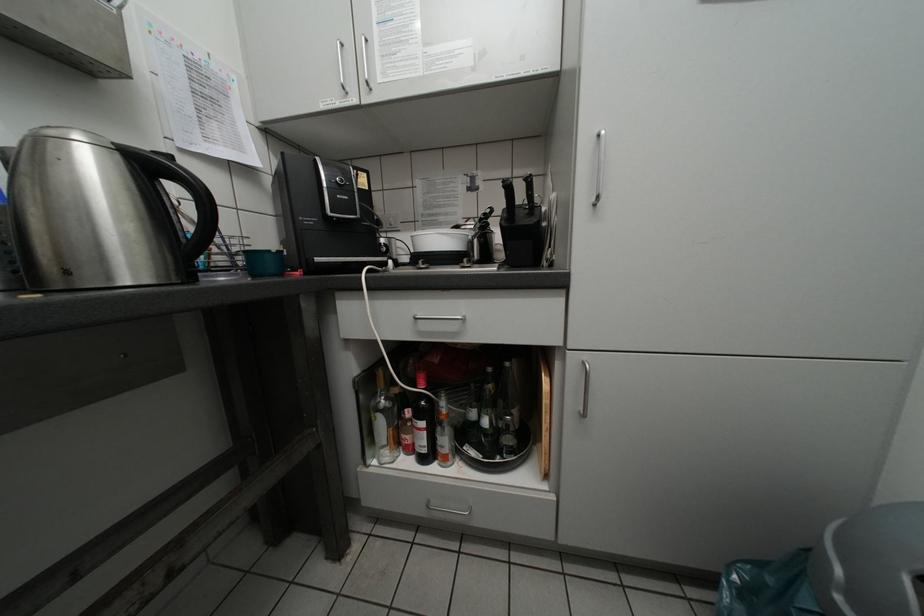
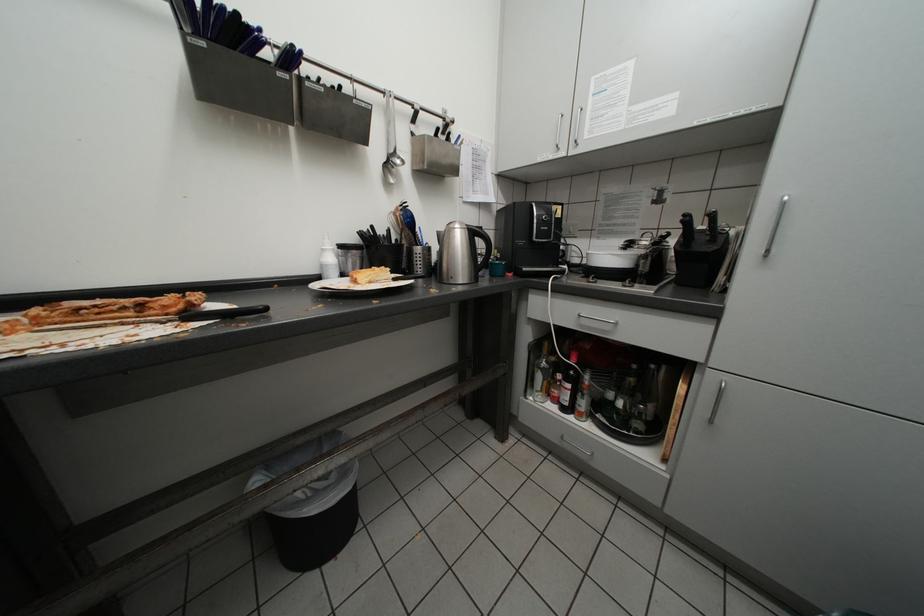
Question: Based on the continuous images, in which direction is the camera rotating? Reply with the corresponding letter.

Choices:
 (A) Left
 (B) Right
 (C) Up
 (D) Down

Answer: (A)